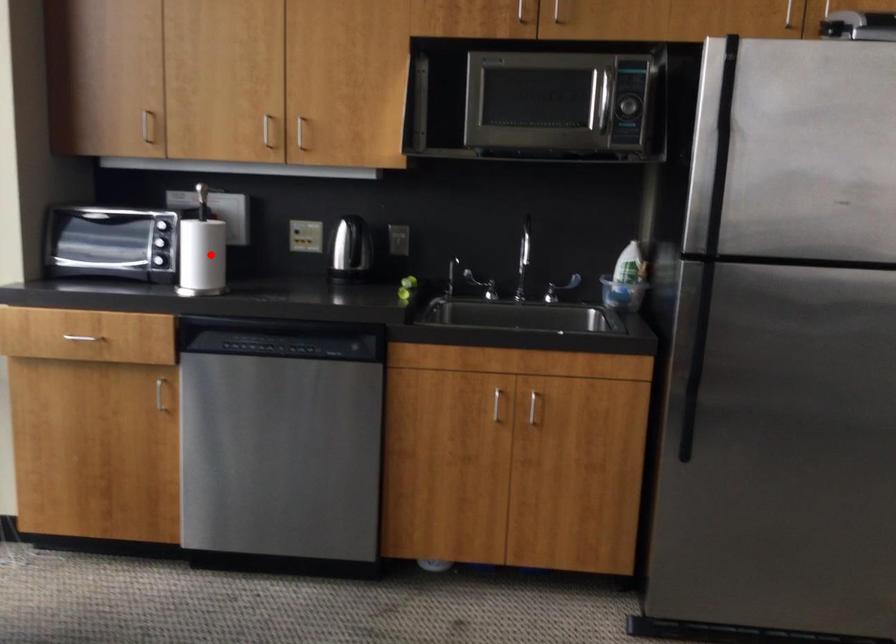
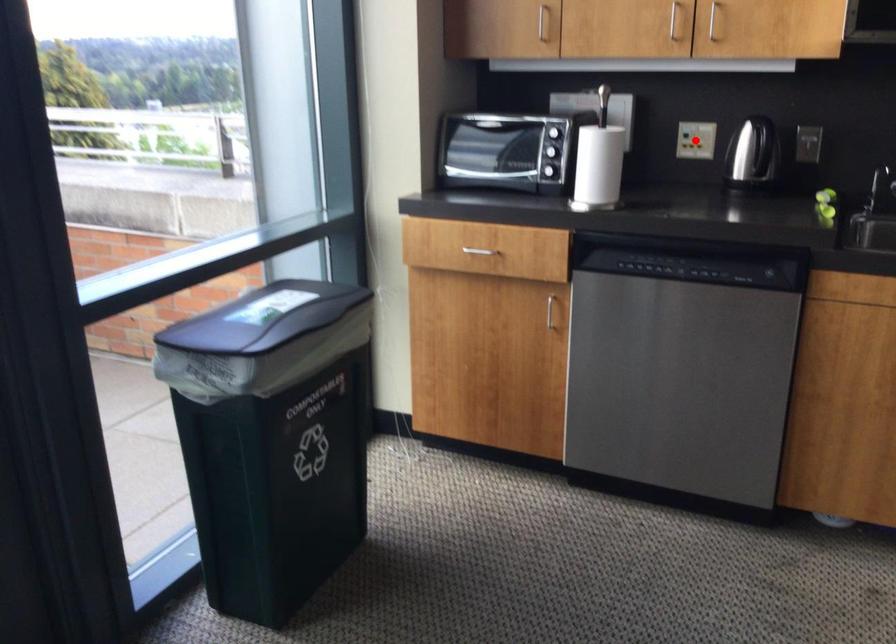
I am providing you with two images of the same scene from different viewpoints. A red point is marked on the first image and another point is marked on the second image. Is the marked point in image1 the same physical position as the marked point in image2?

No